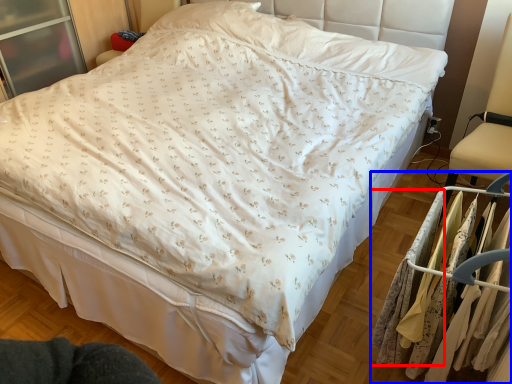
Question: Among these objects, which one is farthest to the camera, clothing (highlighted by a red box) or closet (highlighted by a blue box)?

Choices:
 (A) clothing
 (B) closet

Answer: (A)